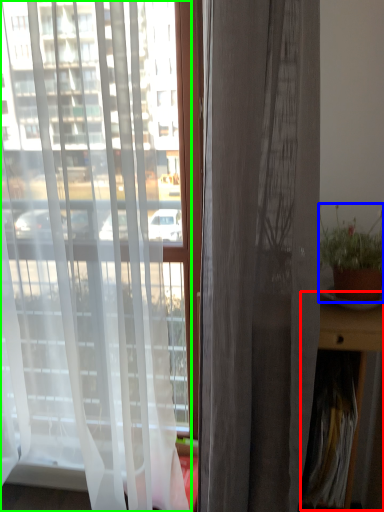
Question: Which object is the closest to the table (highlighted by a red box)? Choose among these: houseplant (highlighted by a blue box) or curtain (highlighted by a green box).

Choices:
 (A) houseplant
 (B) curtain

Answer: (A)